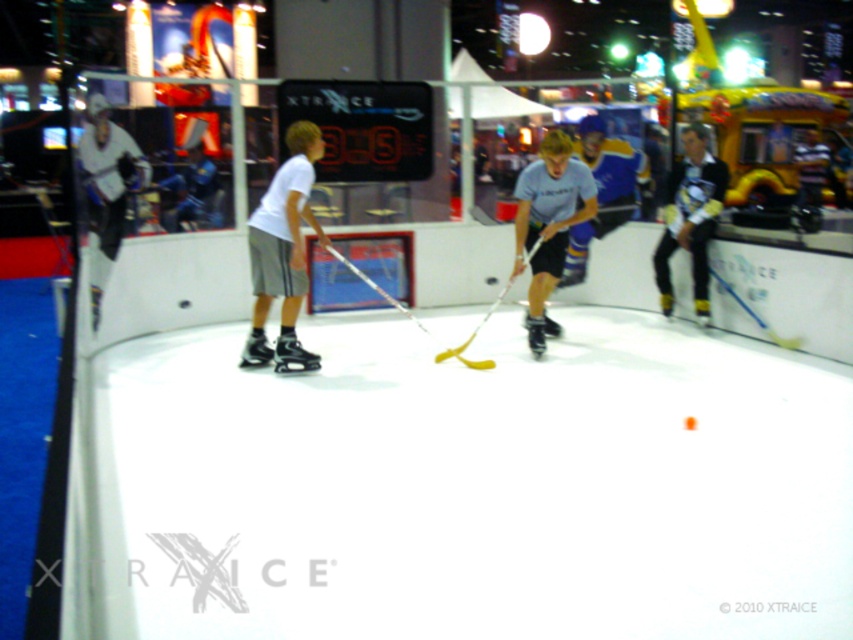
You are setting up an ice rink for a trade show and need to arrange the hockey sticks so that they don not block the players. Given that you have the matte blue hockey stick at center and the yellow plastic hockey stick at center, which hockey stick should you place closer to the edge of the rink to ensure there is enough space for players to move around?

The matte blue hockey stick at center occupies less space than the yellow plastic hockey stick at center, so placing the larger yellow plastic hockey stick at center closer to the edge would leave more space in the center for players to move around.

You are standing at the entrance of the ice rink and want to retrieve the matte blue hockey stick at center. Based on the coordinates provided, in which direction should you move to reach it?

The matte blue hockey stick at center is located at point coordinates, so you should move towards the center of the ice rink to reach it.

You are a photographer positioned at the back of the ice rink. You want to take a photo of the white matte shorts at center and the matte blue hockey stick at center such that both are clearly visible. Based on their positions, which object should you focus on first to ensure both are in focus?

Since the white matte shorts at center is in front of the matte blue hockey stick at center, you should focus on the white matte shorts at center first. This way, both objects will be in focus as the matte blue hockey stick at center is behind it.